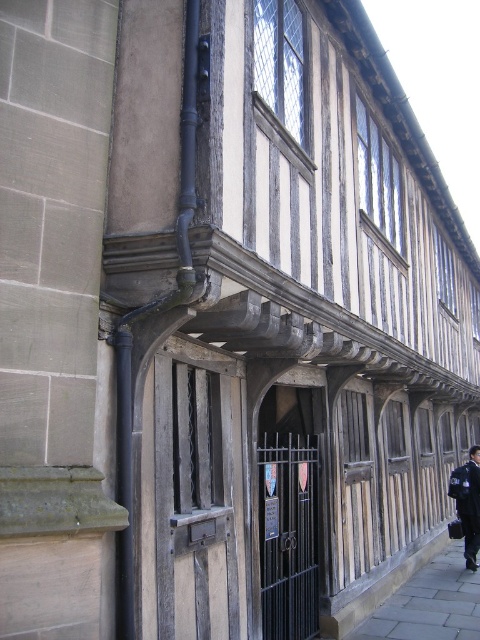
You are a delivery person trying to park your bike. There is a paved stone sidewalk at lower right and a dark blue uniform at center in the image. Which area is more suitable for parking your bike?

The paved stone sidewalk at lower right is smaller than the dark blue uniform at center. Since the sidewalk is a designated area for walking and parking bikes, it would be more appropriate to park there rather than near the dark blue uniform which is likely worn by a person.